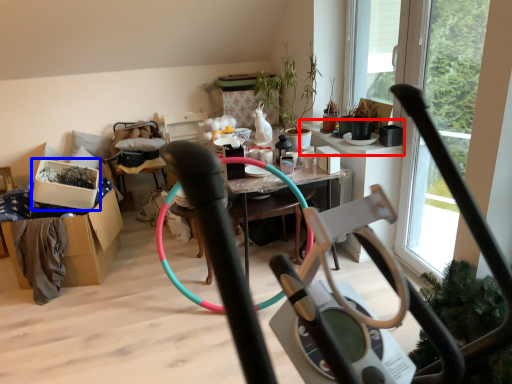
Question: Which point is closer to the camera, window sill (highlighted by a red box) or box (highlighted by a blue box)?

Choices:
 (A) window sill
 (B) box

Answer: (B)